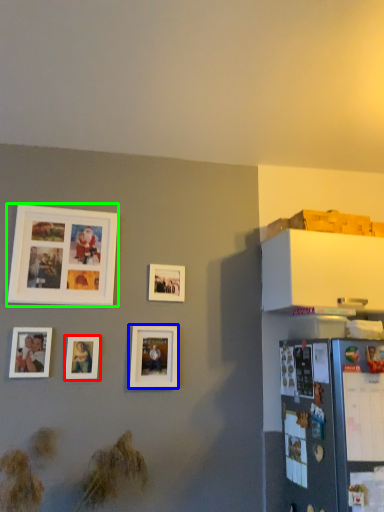
Question: Which is nearer to the picture frame (highlighted by a red box)? picture frame (highlighted by a blue box) or picture frame (highlighted by a green box).

Choices:
 (A) picture frame
 (B) picture frame

Answer: (A)